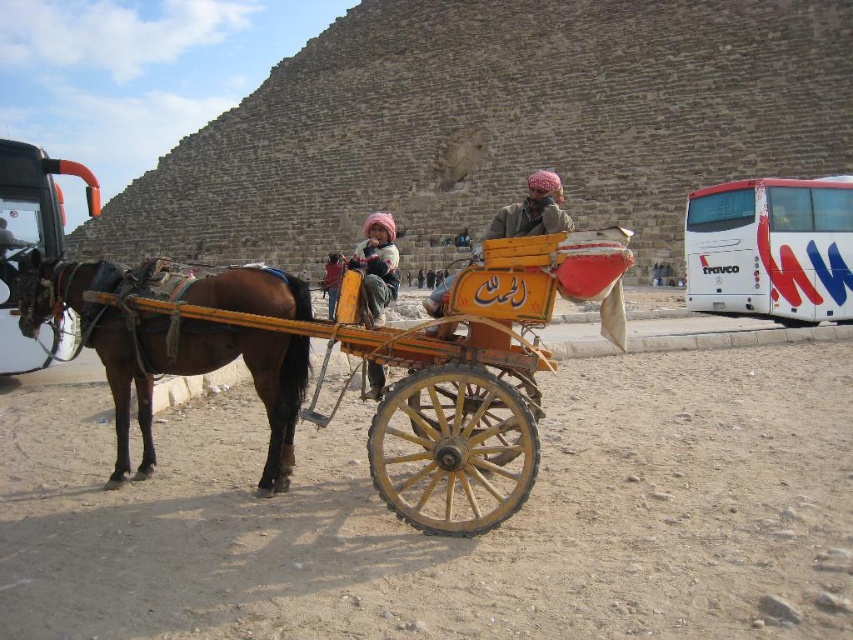
Who is taller, brown glossy horse at left or yellow fabric headscarf at center?

yellow fabric headscarf at center

Which is behind, point (62, 292) or point (331, 253)?

The point (331, 253) is behind.

Is point (120, 356) positioned after point (329, 308)?

No, (120, 356) is closer to viewer.

You are a GUI agent. You are given a task and a screenshot of the screen. Output one action in this format:
    pyautogui.click(x=<x>, y=<y>)
    Task: Click on the brown glossy horse at left
    The height and width of the screenshot is (640, 853).
    Given the screenshot: What is the action you would take?
    pyautogui.click(x=166, y=355)

Does wooden cart at center lie in front of brown glossy horse at left?

Yes, wooden cart at center is in front of brown glossy horse at left.

Measure the distance between wooden cart at center and camera.

24.49 meters

Locate an element on the screen. Image resolution: width=853 pixels, height=640 pixels. wooden cart at center is located at coordinates (378, 358).

Does point (370, 316) lie in front of point (340, 262)?

That is True.

In order to click on soft pink fabric at center in this screenshot , I will do `click(376, 266)`.